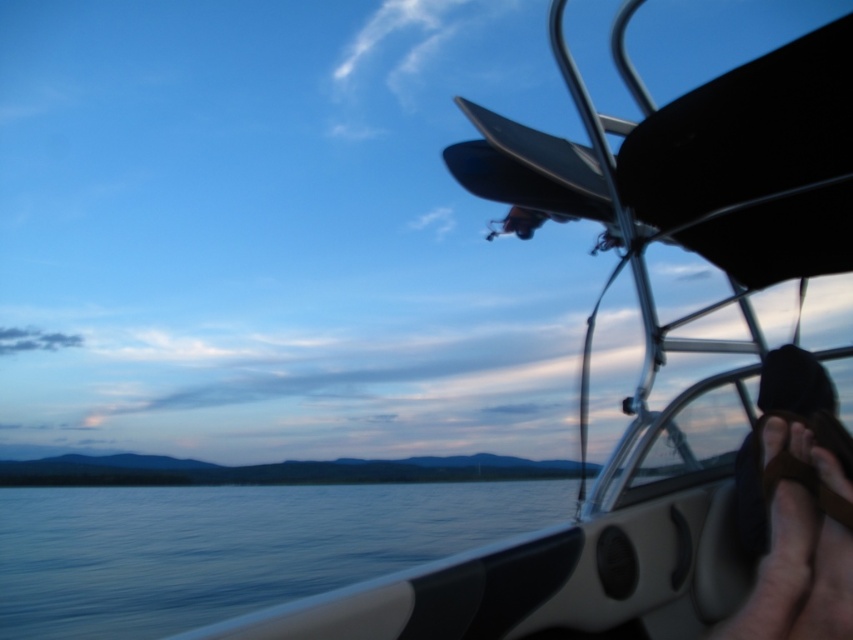
Which is more to the left, smooth water at lower left or black fabric cap at upper right?

From the viewer's perspective, smooth water at lower left appears more on the left side.

Based on the photo, between smooth water at lower left and black fabric cap at upper right, which one has more height?

smooth water at lower left is taller.

Which is in front, point (21, 593) or point (792, 522)?

Point (792, 522)

At what (x,y) coordinates should I click in order to perform the action: click on smooth water at lower left. Please return your answer as a coordinate pair (x, y). This screenshot has height=640, width=853. Looking at the image, I should click on (230, 547).